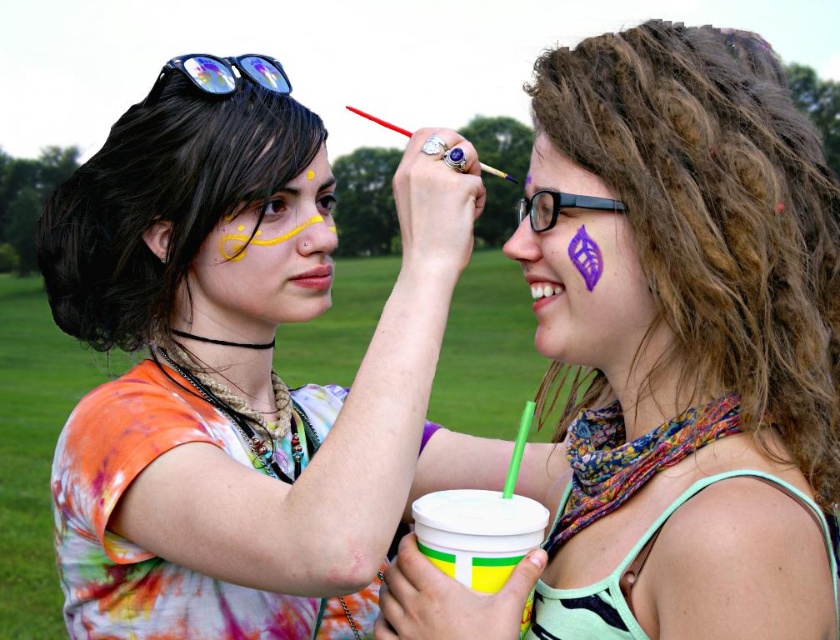
Is matte yellow face paint at upper left smaller than yellow matte paint at upper center?

Actually, matte yellow face paint at upper left might be larger than yellow matte paint at upper center.

From the picture: Can you confirm if matte yellow face paint at upper left is positioned above yellow matte paint at upper center?

No.

What do you see at coordinates (166, 193) in the screenshot? I see `matte yellow face paint at upper left` at bounding box center [166, 193].

Locate an element on the screen. This screenshot has width=840, height=640. matte yellow face paint at upper left is located at coordinates (166, 193).

Can you confirm if purple matte face paint at upper center is thinner than yellow matte paint at upper center?

In fact, purple matte face paint at upper center might be wider than yellow matte paint at upper center.

Between point (617, 205) and point (318, 163), which one is positioned in front?

Point (617, 205)

The height and width of the screenshot is (640, 840). Find the location of `purple matte face paint at upper center`. purple matte face paint at upper center is located at coordinates (562, 182).

Does purple matte face paint at upper right come in front of reflective plastic sunglasses at upper left?

Yes, it is.

Is purple matte face paint at upper right below reflective plastic sunglasses at upper left?

Indeed, purple matte face paint at upper right is positioned under reflective plastic sunglasses at upper left.

Is point (794, 314) closer to viewer compared to point (256, 72)?

Yes, point (794, 314) is closer to viewer.

Identify the location of purple matte face paint at upper right. The width and height of the screenshot is (840, 640). (675, 358).